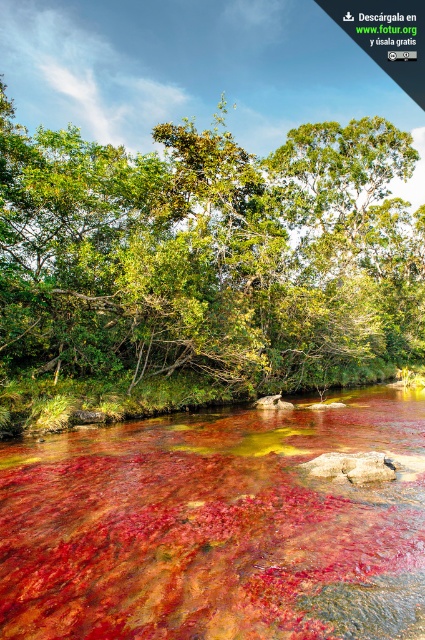
Question: Is green leafy tree at center behind translucent red water at center?

Choices:
 (A) yes
 (B) no

Answer: (A)

Question: Which object is closer to the camera taking this photo?

Choices:
 (A) translucent red water at center
 (B) green leafy tree at center

Answer: (A)

Question: Does green leafy tree at center lie behind translucent red water at center?

Choices:
 (A) no
 (B) yes

Answer: (B)

Question: Observing the image, what is the correct spatial positioning of green leafy tree at center in reference to translucent red water at center?

Choices:
 (A) below
 (B) above

Answer: (B)

Question: Which object appears closest to the camera in this image?

Choices:
 (A) translucent red water at center
 (B) green leafy tree at center

Answer: (A)